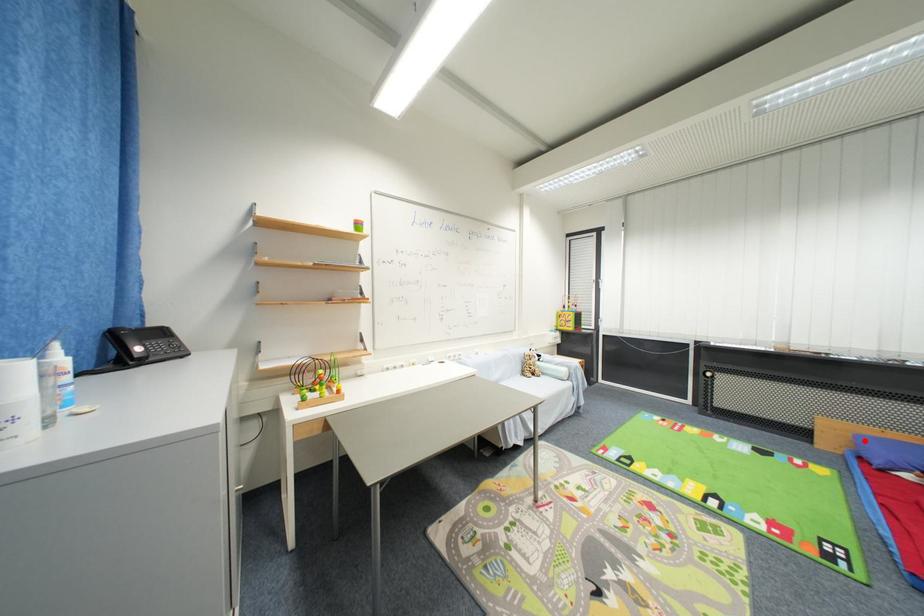
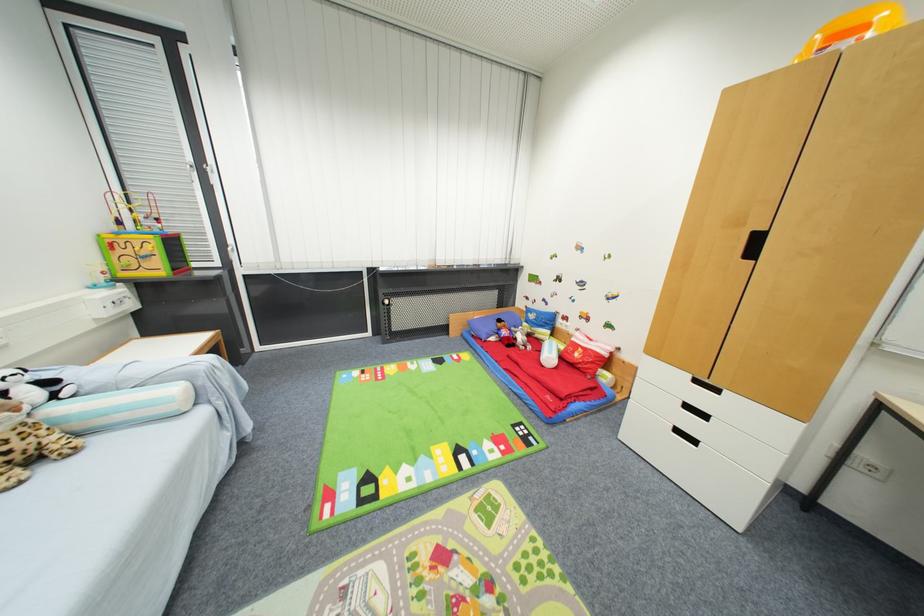
Locate, in the second image, the point that corresponds to the highlighted location in the first image.

(475, 325)